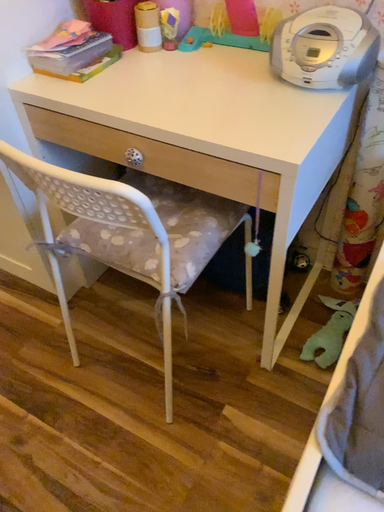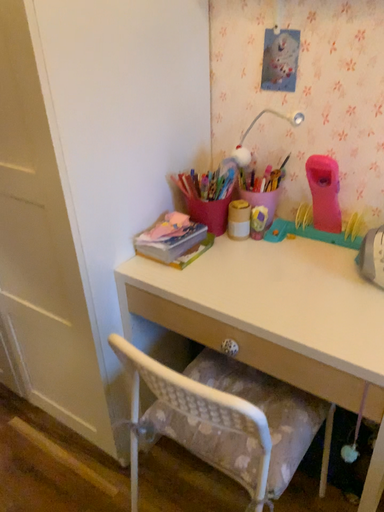
Question: How did the camera likely rotate when shooting the video?

Choices:
 (A) rotated upward
 (B) rotated downward

Answer: (A)